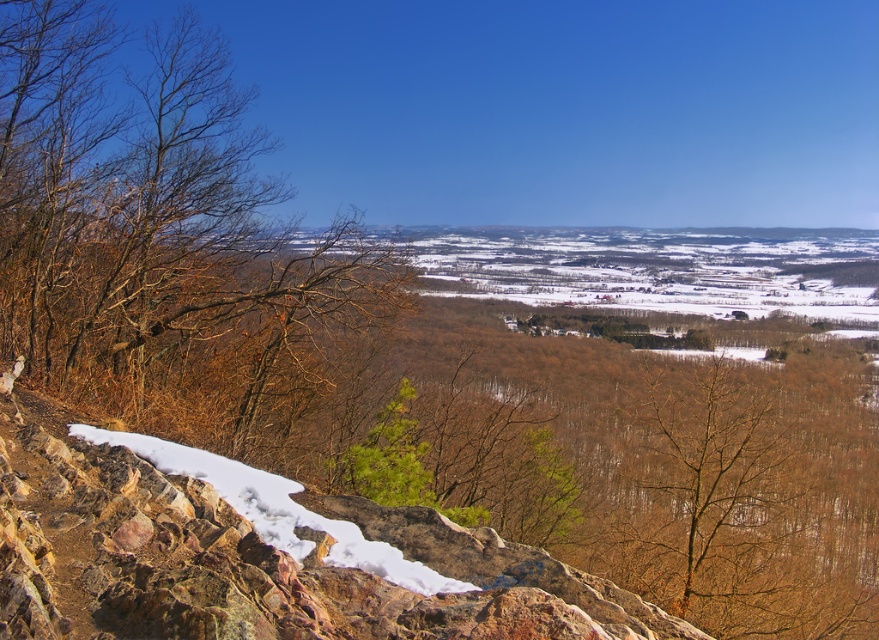
Is point (354, 225) closer to camera compared to point (628, 460)?

No.

Which of these two, brown leafless branches at left or brown leafless tree at center, stands taller?

Standing taller between the two is brown leafless branches at left.

This screenshot has height=640, width=879. In order to click on brown leafless branches at left in this screenshot , I will do `click(166, 243)`.

Where is `brown leafless branches at left`? The height and width of the screenshot is (640, 879). brown leafless branches at left is located at coordinates (166, 243).